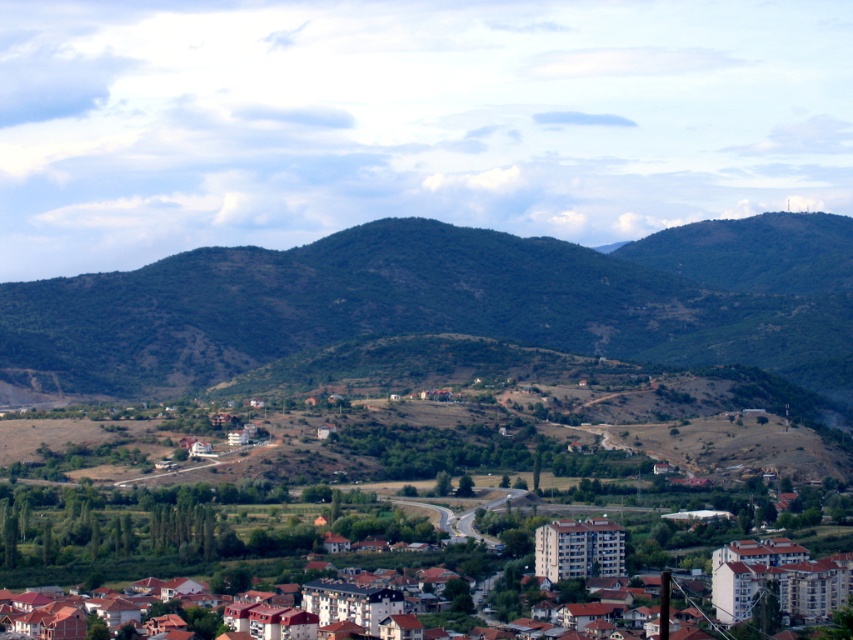
Does green leafy hillside at center appear on the left side of brown brick houses at center?

Incorrect, green leafy hillside at center is not on the left side of brown brick houses at center.

Between point (706, 356) and point (167, 502), which one is positioned in front?

Point (706, 356) is more forward.

This screenshot has height=640, width=853. Describe the element at coordinates (448, 301) in the screenshot. I see `green leafy hillside at center` at that location.

At what (x,y) coordinates should I click in order to perform the action: click on green leafy hillside at center. Please return your answer as a coordinate pair (x, y). Looking at the image, I should click on (448, 301).